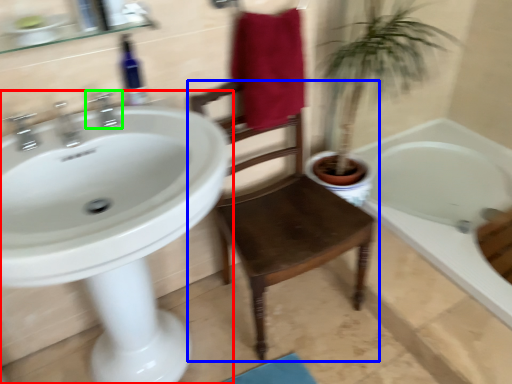
Question: Estimate the real-world distances between objects in this image. Which object is closer to sink (highlighted by a red box), chair (highlighted by a blue box) or tap (highlighted by a green box)?

Choices:
 (A) chair
 (B) tap

Answer: (B)